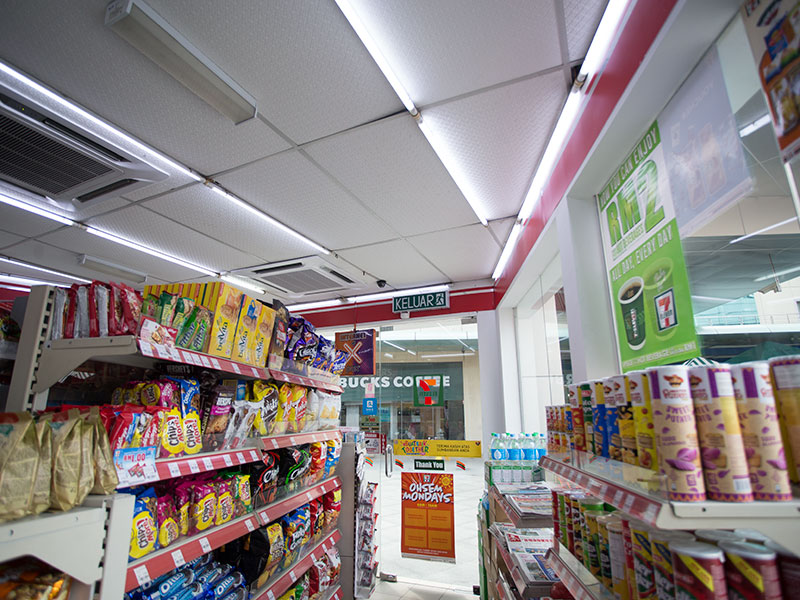
The height and width of the screenshot is (600, 800). I want to click on floor, so click(x=406, y=590), click(x=466, y=498), click(x=384, y=505).